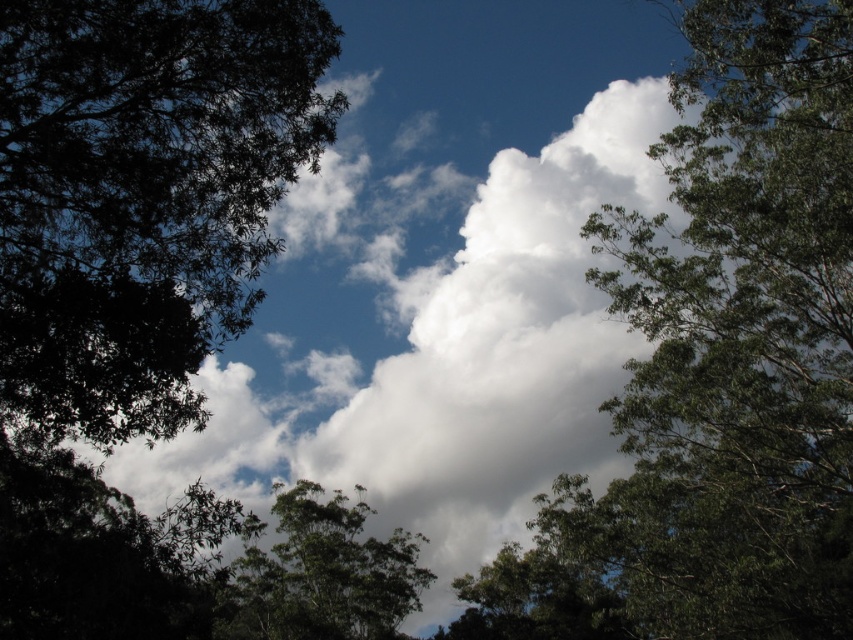
You are an observer looking at the sky scene. You notice two green leafy trees in the image. Which tree is closer to you, the green leafy tree at upper right or the green leafy tree at center?

The green leafy tree at upper right is closer to you because it is in front of the green leafy tree at center.

You are a bird flying over a forest. You see the green leafy tree at upper right and the green leafy tree at center. Which tree is positioned higher in the sky?

The green leafy tree at upper right is positioned higher in the sky than the green leafy tree at center.